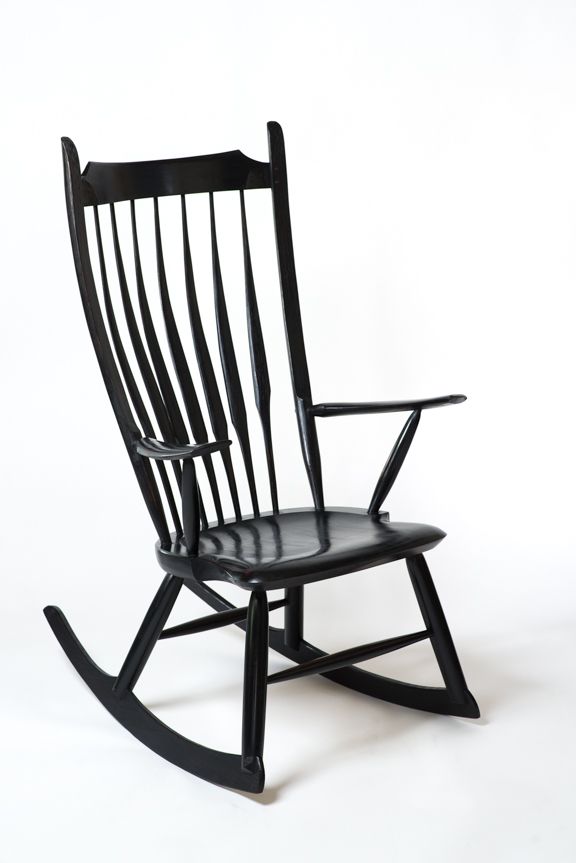
This screenshot has width=576, height=863. What are the coordinates of `arm of rocking chair` in the screenshot? It's located at (372, 406), (157, 448).